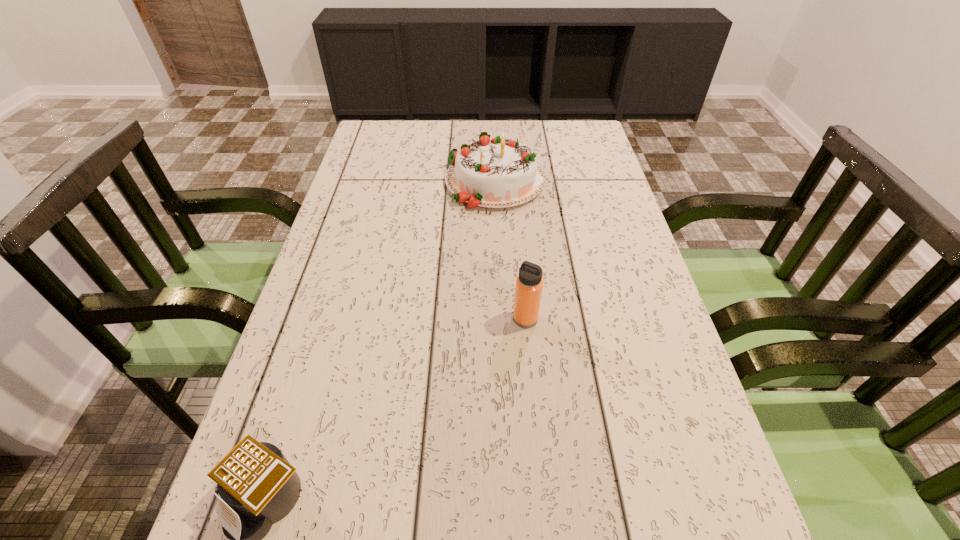
I want to click on vacant space that's between the thermos bottle and the cake, so click(510, 250).

Locate an element on the screen. The image size is (960, 540). object that can be found as the closest to the cake is located at coordinates (529, 284).

At what (x,y) coordinates should I click in order to perform the action: click on object that is the nearest to the farthest object. Please return your answer as a coordinate pair (x, y). Looking at the image, I should click on (529, 284).